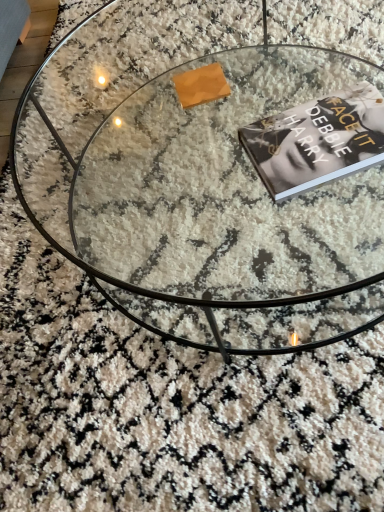
Locate an element on the screen. The image size is (384, 512). free point above black matte book at center (from a real-world perspective) is located at coordinates (324, 130).